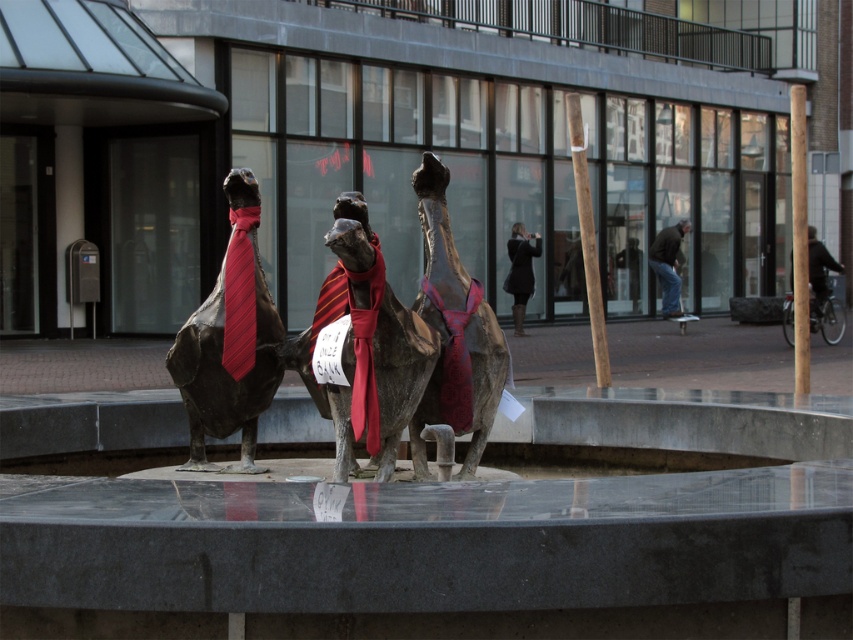
You are an artist planning to place a 1.8 meters tall sculpture in front of the polished bronze camel at center and the dark brown leather jacket at center. Which object should you place it closer to if you want the sculpture to appear smaller in comparison?

The polished bronze camel at center is not as tall as the dark brown leather jacket at center, so placing the 1.8 meters tall sculpture closer to the dark brown leather jacket at center would make it appear smaller in comparison.

You are standing in front of the public art installation. There is a shiny bronze statue at center. Where is the point at coordinates point (229, 340) located in relation to the shiny bronze statue at center?

The point at coordinates point (229, 340) indicates the location of the shiny bronze statue at center.

Consider the image. You are an artist planning to place a 2.5 meter wide sculpture in front of the polished bronze camel at center and dark brown leather jacket at center. Based on their widths, which object should the sculpture be placed next to to ensure it doesn

The polished bronze camel at center has a lesser width compared to dark brown leather jacket at center. Therefore, the 2.5 meter wide sculpture should be placed next to the dark brown leather jacket at center to ensure it doesn